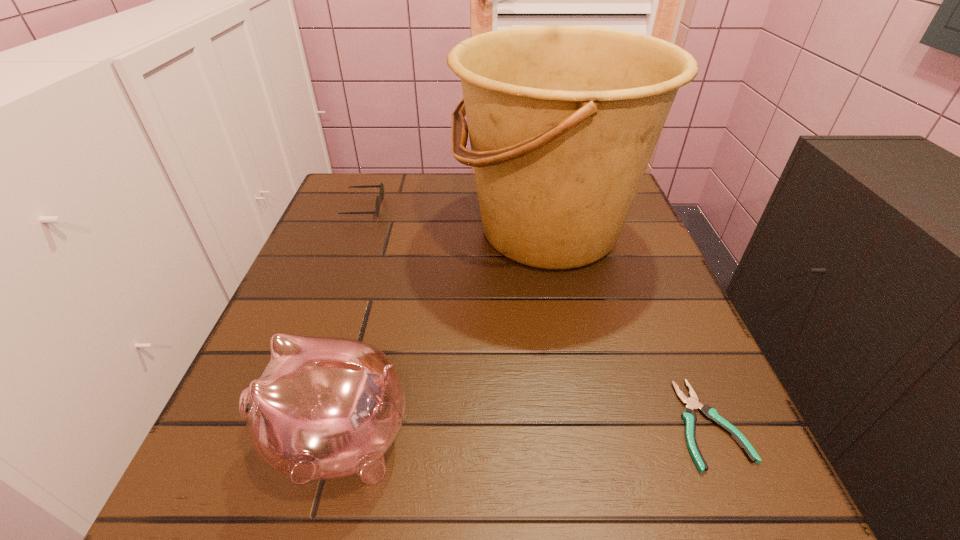
Find the location of `the tallest object`. the tallest object is located at coordinates (563, 120).

Locate an element on the screen. piggy bank is located at coordinates (324, 408).

Locate an element on the screen. Image resolution: width=960 pixels, height=540 pixels. sunglasses is located at coordinates (377, 206).

Find the location of a particular element. the shortest object is located at coordinates (692, 403).

The height and width of the screenshot is (540, 960). Find the location of `free location located 0.110m on the side of the bucket with the handle`. free location located 0.110m on the side of the bucket with the handle is located at coordinates (406, 231).

This screenshot has width=960, height=540. In order to click on vacant area located 0.230m on the side of the bucket with the handle in this screenshot , I will do `click(353, 231)`.

Find the location of a particular element. This screenshot has width=960, height=540. vacant region located 0.260m on the side of the bucket with the handle is located at coordinates (340, 231).

You are a GUI agent. You are given a task and a screenshot of the screen. Output one action in this format:
    pyautogui.click(x=<x>, y=<y>)
    Task: Click on the vacant space positioned 0.050m on the front facing side of the piggy bank
    
    Given the screenshot: What is the action you would take?
    pyautogui.click(x=231, y=441)

In order to click on free space located on the front-facing side of the sunglasses in this screenshot , I will do `click(455, 207)`.

Where is `vacant space located 0.290m on the back of the pliers`? The width and height of the screenshot is (960, 540). vacant space located 0.290m on the back of the pliers is located at coordinates (640, 265).